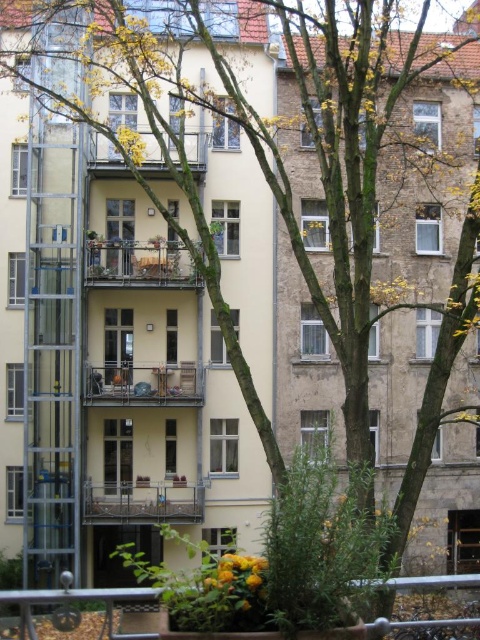
Question: From the image, what is the correct spatial relationship of wooden railing at center in relation to wooden balcony at upper center?

Choices:
 (A) below
 (B) above

Answer: (A)

Question: Can you confirm if metallic balcony at center is thinner than wooden balcony at upper center?

Choices:
 (A) no
 (B) yes

Answer: (A)

Question: Which of the following is the closest to the observer?

Choices:
 (A) (173, 499)
 (B) (97, 244)

Answer: (B)

Question: Which object is positioned closest to the wooden balcony at upper center?

Choices:
 (A) wooden railing at center
 (B) metallic silver balcony at center

Answer: (A)

Question: Is metallic silver balcony at center to the right of wooden balcony at upper center from the viewer's perspective?

Choices:
 (A) no
 (B) yes

Answer: (B)

Question: Which of the following is the farthest from the observer?

Choices:
 (A) metallic silver railing at lower center
 (B) wooden balcony at upper center

Answer: (B)